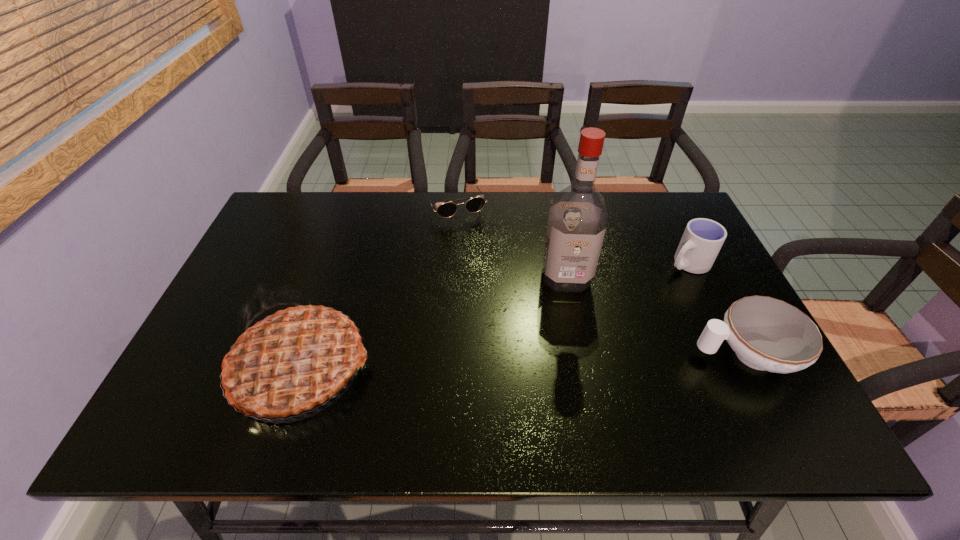
At what (x,y) coordinates should I click in order to perform the action: click on vacant space that's between the fourth shortest object and the tallest object. Please return your answer as a coordinate pair (x, y). This screenshot has width=960, height=540. Looking at the image, I should click on (434, 322).

Find the location of a particular element. vacant area that lies between the shortest object and the chinaware is located at coordinates (600, 281).

Find the location of a particular element. free space between the second tallest object and the second object from left to right is located at coordinates (378, 288).

Locate an element on the screen. Image resolution: width=960 pixels, height=540 pixels. empty location between the second shortest object and the fourth object from right to left is located at coordinates (600, 281).

Identify the location of vacant area that lies between the liquor and the cup. (627, 270).

You are a GUI agent. You are given a task and a screenshot of the screen. Output one action in this format:
    pyautogui.click(x=<x>, y=<y>)
    Task: Click on the object that is the fourth closest one to the farthest object
    
    Given the screenshot: What is the action you would take?
    [x=769, y=334]

Where is `object that stands as the closest to the farthest object`? The width and height of the screenshot is (960, 540). object that stands as the closest to the farthest object is located at coordinates (577, 222).

Where is `vacant area in the image that satisfies the following two spatial constraints: 1. on the back side of the tallest object; 2. on the left side of the cup`? This screenshot has height=540, width=960. vacant area in the image that satisfies the following two spatial constraints: 1. on the back side of the tallest object; 2. on the left side of the cup is located at coordinates (564, 263).

Locate an element on the screen. The image size is (960, 540). vacant space that satisfies the following two spatial constraints: 1. on the front side of the chinaware; 2. on the side with the handle of the farthest object is located at coordinates (446, 354).

Identify the location of vacant space that satisfies the following two spatial constraints: 1. on the back side of the cup; 2. on the left side of the leftmost object. This screenshot has width=960, height=540. (336, 263).